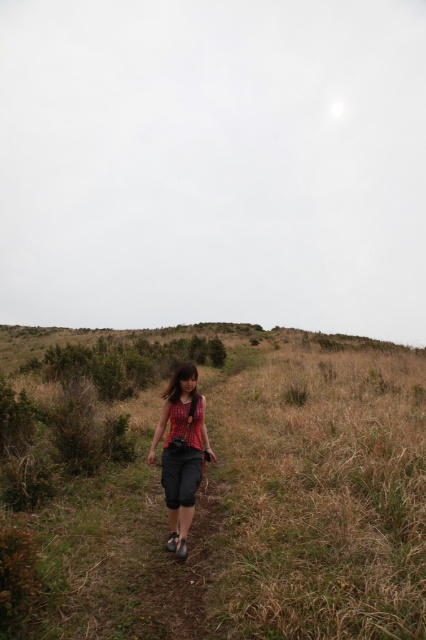
In order to click on dry grass at center in this screenshot , I will do `click(213, 486)`.

Between dry grass at center and matte black tank top at center, which one appears on the right side from the viewer's perspective?

dry grass at center

The image size is (426, 640). Identify the location of dry grass at center. (213, 486).

Find the location of a particular element. Image resolution: width=426 pixels, height=640 pixels. dry grass at center is located at coordinates (213, 486).